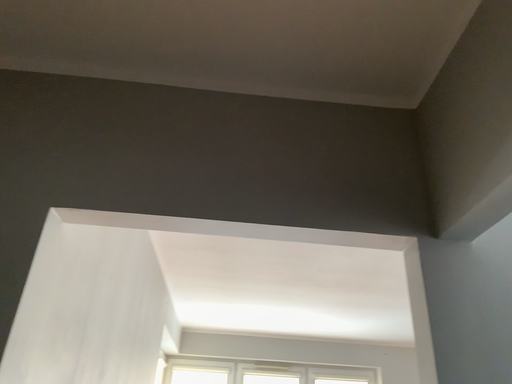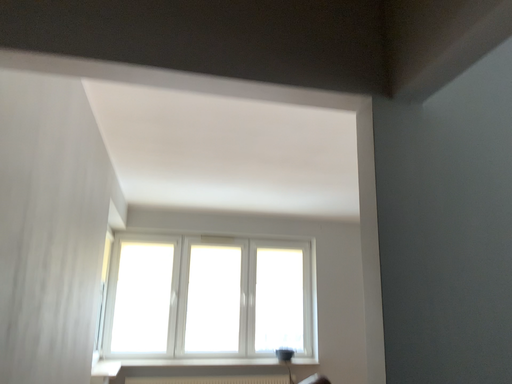
Question: How did the camera likely rotate when shooting the video?

Choices:
 (A) rotated left
 (B) rotated right

Answer: (B)